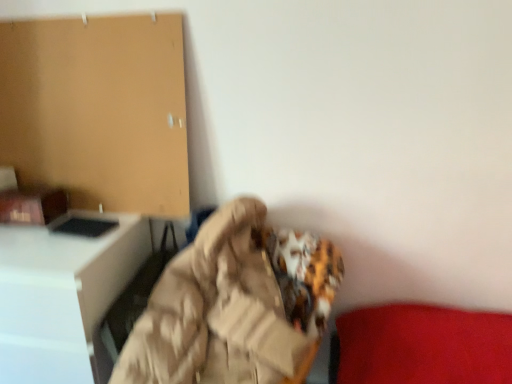
Question: Considering the positions of white glossy desk at left and beige fabric bean bag chair at center in the image, is white glossy desk at left bigger or smaller than beige fabric bean bag chair at center?

Choices:
 (A) small
 (B) big

Answer: (B)

Question: From the image's perspective, is white glossy desk at left above or below beige fabric bean bag chair at center?

Choices:
 (A) below
 (B) above

Answer: (A)

Question: From a real-world perspective, is white glossy desk at left above or below beige fabric bean bag chair at center?

Choices:
 (A) above
 (B) below

Answer: (B)

Question: Do you think beige fabric bean bag chair at center is within white glossy desk at left, or outside of it?

Choices:
 (A) outside
 (B) inside

Answer: (A)

Question: Considering the positions of beige fabric bean bag chair at center and white glossy desk at left in the image, is beige fabric bean bag chair at center wider or thinner than white glossy desk at left?

Choices:
 (A) thin
 (B) wide

Answer: (B)

Question: Considering the positions of point (160, 278) and point (118, 286), is point (160, 278) closer or farther from the camera than point (118, 286)?

Choices:
 (A) closer
 (B) farther

Answer: (A)

Question: In the image, is beige fabric bean bag chair at center positioned in front of or behind white glossy desk at left?

Choices:
 (A) behind
 (B) front

Answer: (B)